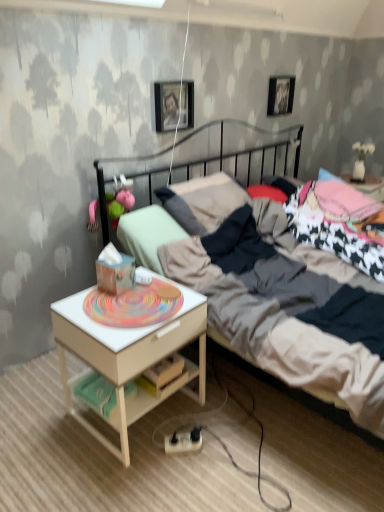
Locate an element on the screen. vacant space in front of white wood nightstand at lower left is located at coordinates 127,481.